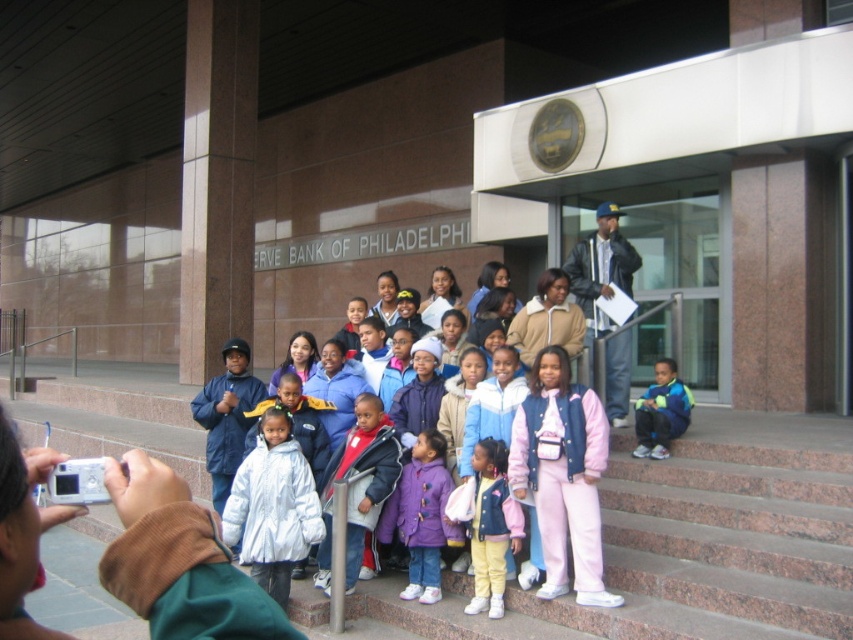
Question: Which point is closer to the camera taking this photo?

Choices:
 (A) (596, 218)
 (B) (263, 433)
 (C) (519, 531)

Answer: (C)

Question: Is white shiny coat at center in front of purple fleece jacket at center?

Choices:
 (A) no
 (B) yes

Answer: (B)

Question: Is light purple fleece jacket at center bigger than blue fleece jacket at center?

Choices:
 (A) yes
 (B) no

Answer: (B)

Question: Which object appears closest to the camera in this image?

Choices:
 (A) light purple fleece jacket at center
 (B) white shiny coat at center

Answer: (A)

Question: Can you confirm if white shiny coat at center is wider than blue fleece jacket at center?

Choices:
 (A) no
 (B) yes

Answer: (B)

Question: Among these points, which one is nearest to the camera?

Choices:
 (A) (671, 435)
 (B) (625, 259)
 (C) (408, 586)

Answer: (C)